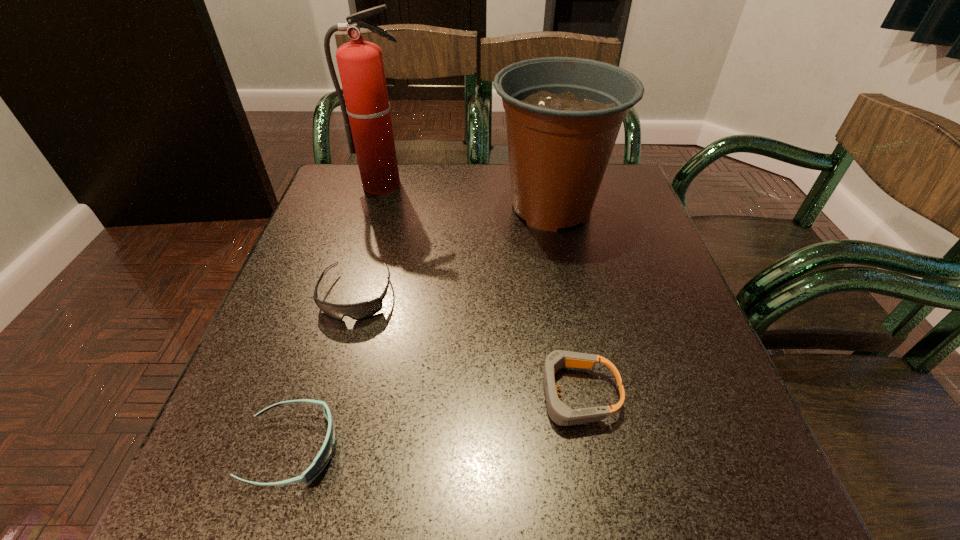
Find the location of `fire extinguisher`. fire extinguisher is located at coordinates (367, 119).

Locate an element on the screen. This screenshot has width=960, height=540. flowerpot is located at coordinates (563, 114).

What are the coordinates of `the farthest goggles` in the screenshot? It's located at (363, 310).

Where is `the rightmost goggles`? the rightmost goggles is located at coordinates (560, 413).

You are a GUI agent. You are given a task and a screenshot of the screen. Output one action in this format:
    pyautogui.click(x=<x>, y=<y>)
    Task: Click on the vacant space located with the nozzle and gauge on the fire extinguisher
    The width and height of the screenshot is (960, 540).
    Given the screenshot: What is the action you would take?
    pyautogui.click(x=368, y=239)

Locate an element on the screen. vacant region located on the front of the flowerpot is located at coordinates 569,298.

I want to click on vacant space located on the lenses of the third nearest object, so click(x=318, y=435).

At what (x,y) coordinates should I click in order to perform the action: click on free space located on the front and back of the rightmost goggles. Please return your answer as a coordinate pair (x, y). This screenshot has width=960, height=540. Looking at the image, I should click on (296, 394).

You are a GUI agent. You are given a task and a screenshot of the screen. Output one action in this format:
    pyautogui.click(x=<x>, y=<y>)
    Task: Click on the free space located 0.310m on the front and back of the rightmost goggles
    The width and height of the screenshot is (960, 540).
    Given the screenshot: What is the action you would take?
    [344, 394]

At what (x,y) coordinates should I click in order to perform the action: click on vacant space located 0.300m on the front and back of the rightmost goggles. Please return your answer as a coordinate pair (x, y). This screenshot has width=960, height=540. Looking at the image, I should click on (350, 394).